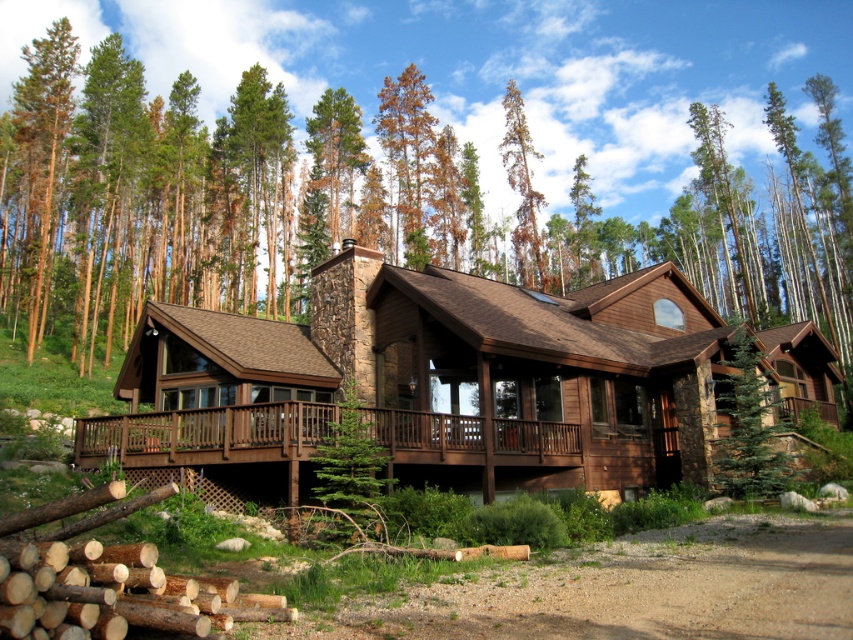
You are a bird looking for a nesting spot. You see a brown wood tree at left and a brown bark tree at upper center. Which tree has a wider trunk to support your nest?

The brown wood tree at left might be wider than brown bark tree at upper center, so it could provide a better support for the nest.

You are standing on the deck of the rustic house and notice two trees in the scene. Which tree, the brown wood tree at left or the brown bark tree at upper center, is closer to you?

The brown wood tree at left is closer to you because it is positioned over the brown bark tree at upper center, indicating it is in front.